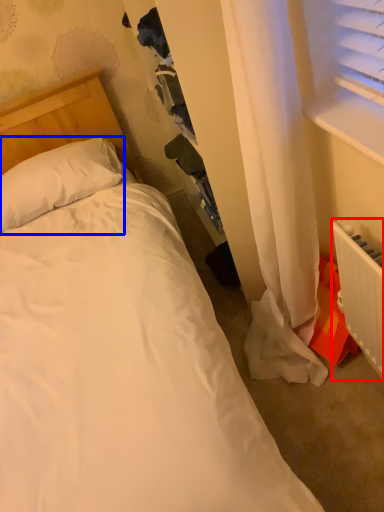
Question: Which object is further to the camera taking this photo, radiator (highlighted by a red box) or pillow (highlighted by a blue box)?

Choices:
 (A) radiator
 (B) pillow

Answer: (B)